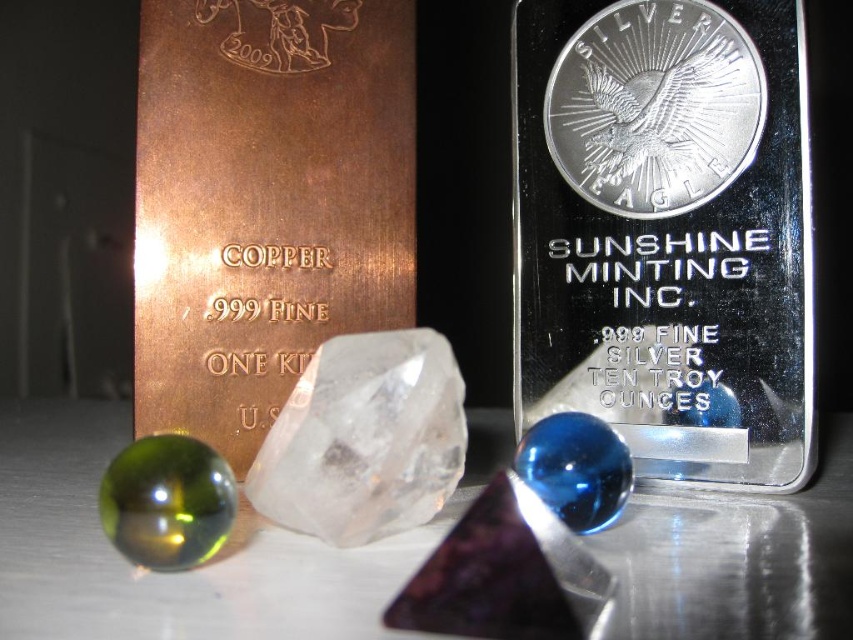
Question: Is silver/metallic coin at center smaller than transparent crystal at center?

Choices:
 (A) no
 (B) yes

Answer: (A)

Question: Is silver/metallic coin at center wider than transparent crystal at center?

Choices:
 (A) yes
 (B) no

Answer: (A)

Question: Which of the following is the farthest from the observer?

Choices:
 (A) [x=338, y=336]
 (B) [x=657, y=134]

Answer: (A)

Question: In this image, where is silver/metallic coin at center located relative to transparent crystal at center?

Choices:
 (A) above
 (B) below

Answer: (A)